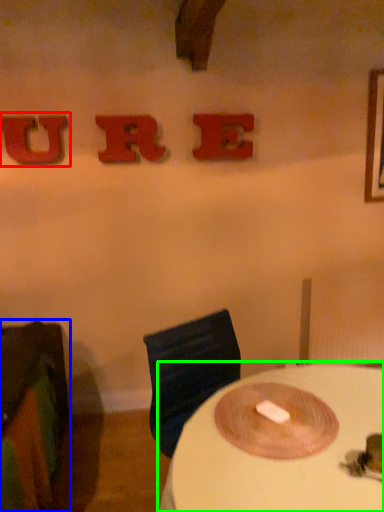
Question: Which object is the closest to the alphabet (highlighted by a red box)? Choose among these: furniture (highlighted by a blue box) or table (highlighted by a green box).

Choices:
 (A) furniture
 (B) table

Answer: (A)